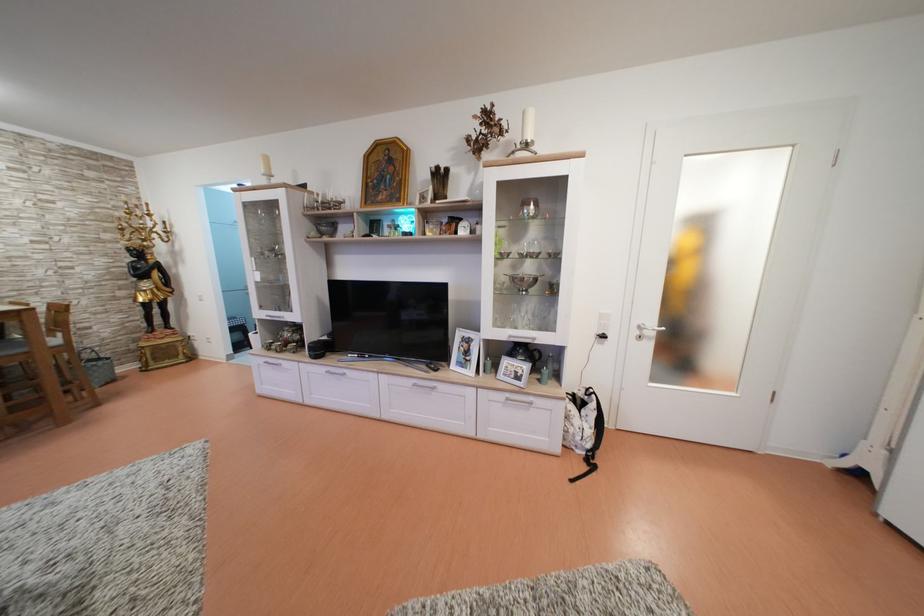
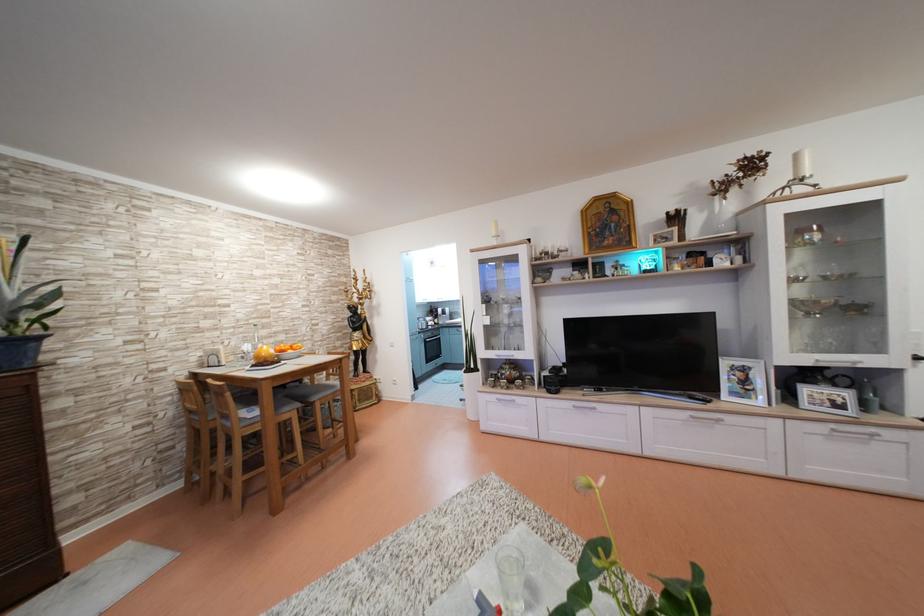
Question: In a continuous first-person perspective shot, in which direction is the camera moving?

Choices:
 (A) Left
 (B) Right
 (C) Forward
 (D) Backward

Answer: (A)